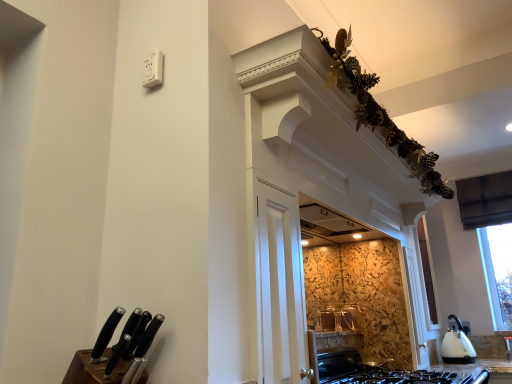
Question: Is black plastic knife at lower left, placed as the 1th knife when sorted from left to right, smaller than black matte knife at lower left, the second knife in the left-to-right sequence?

Choices:
 (A) no
 (B) yes

Answer: (B)

Question: Can you confirm if black plastic knife at lower left, which is the 2th knife from right to left, is taller than black matte knife at lower left, the second knife in the left-to-right sequence?

Choices:
 (A) no
 (B) yes

Answer: (A)

Question: Is black plastic knife at lower left, placed as the 1th knife when sorted from left to right, shorter than black matte knife at lower left, acting as the first knife starting from the right?

Choices:
 (A) no
 (B) yes

Answer: (B)

Question: From a real-world perspective, is black plastic knife at lower left, placed as the 1th knife when sorted from left to right, under black matte knife at lower left, the second knife in the left-to-right sequence?

Choices:
 (A) no
 (B) yes

Answer: (A)

Question: Considering the relative sizes of black plastic knife at lower left, placed as the 1th knife when sorted from left to right, and black matte knife at lower left, the second knife in the left-to-right sequence, in the image provided, is black plastic knife at lower left, placed as the 1th knife when sorted from left to right, bigger than black matte knife at lower left, the second knife in the left-to-right sequence,?

Choices:
 (A) yes
 (B) no

Answer: (B)

Question: Can you confirm if black plastic knife at lower left, which is the 2th knife from right to left, is thinner than black matte knife at lower left, the second knife in the left-to-right sequence?

Choices:
 (A) no
 (B) yes

Answer: (B)

Question: Is brown wooden knife block at lower left facing away from black matte knife at lower left, the second knife in the left-to-right sequence?

Choices:
 (A) yes
 (B) no

Answer: (B)

Question: Does brown wooden knife block at lower left have a greater height compared to black matte knife at lower left, acting as the first knife starting from the right?

Choices:
 (A) yes
 (B) no

Answer: (B)

Question: Is brown wooden knife block at lower left at the left side of black matte knife at lower left, acting as the first knife starting from the right?

Choices:
 (A) no
 (B) yes

Answer: (B)

Question: From the image's perspective, is brown wooden knife block at lower left over black matte knife at lower left, acting as the first knife starting from the right?

Choices:
 (A) yes
 (B) no

Answer: (B)

Question: Can you confirm if brown wooden knife block at lower left is bigger than black matte knife at lower left, the second knife in the left-to-right sequence?

Choices:
 (A) no
 (B) yes

Answer: (B)

Question: Is brown wooden knife block at lower left further to camera compared to black matte knife at lower left, acting as the first knife starting from the right?

Choices:
 (A) no
 (B) yes

Answer: (A)

Question: Considering the relative positions of black matte knife at lower left, the second knife in the left-to-right sequence, and brown wooden knife block at lower left in the image provided, is black matte knife at lower left, the second knife in the left-to-right sequence, behind brown wooden knife block at lower left?

Choices:
 (A) yes
 (B) no

Answer: (A)